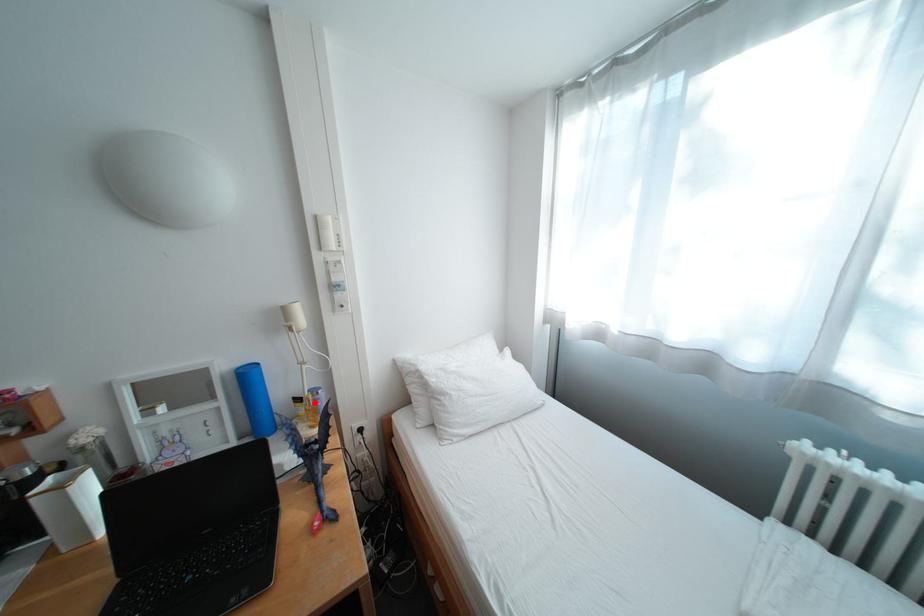
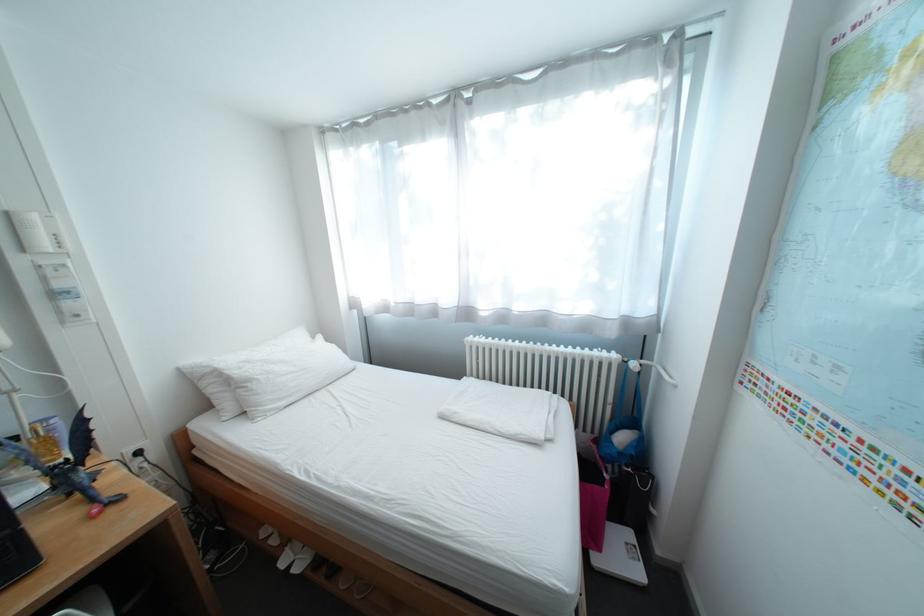
Question: A red point is marked in image1. In image2, is the corresponding 3D point closer to the camera or farther? Reply with the corresponding letter.

Choices:
 (A) The corresponding 3D point is closer.
 (B) The corresponding 3D point is farther.

Answer: (A)